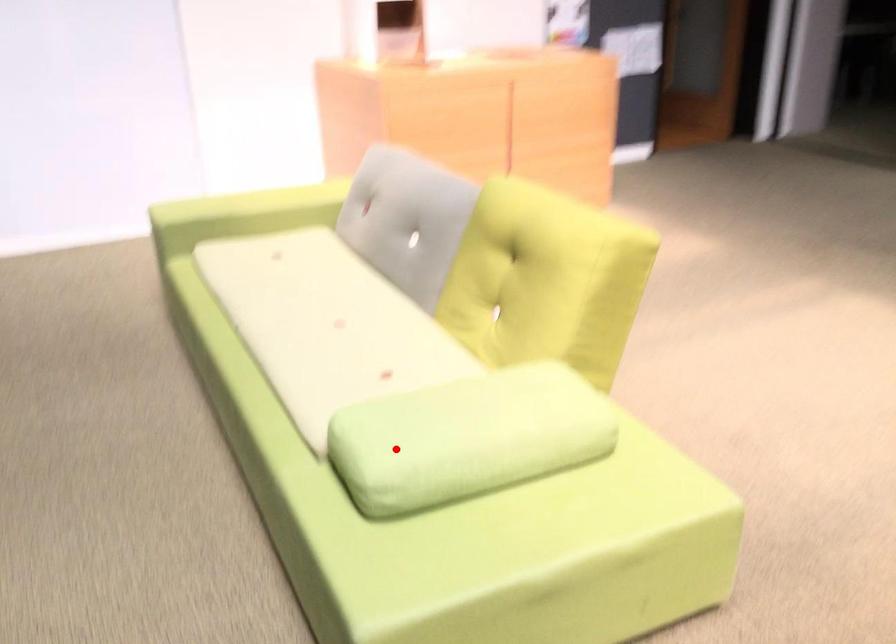
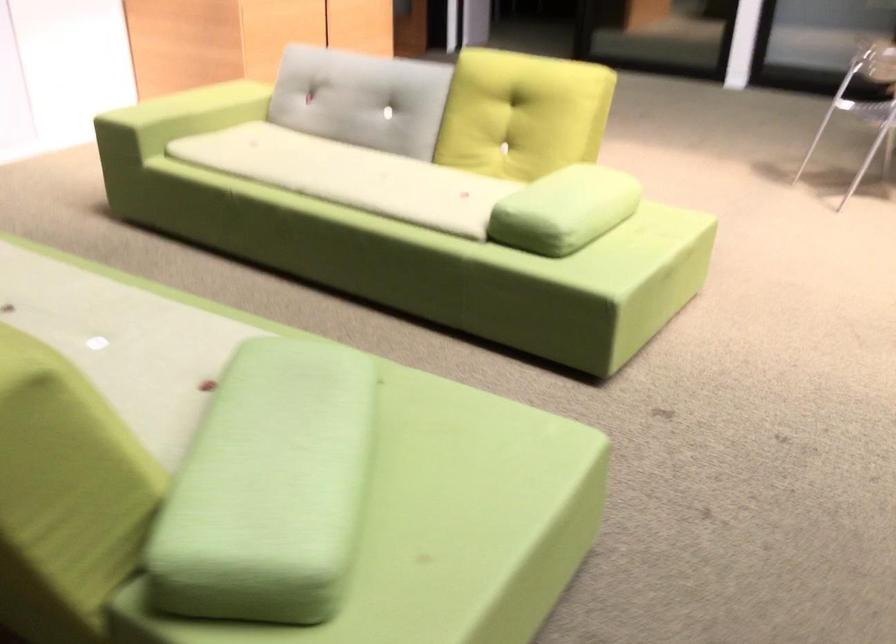
Question: I am providing you with two images of the same scene from different viewpoints. Given a red point in image1, look at the same physical point in image2. Is it:

Choices:
 (A) Closer to the viewpoint
 (B) Farther from the viewpoint

Answer: (B)